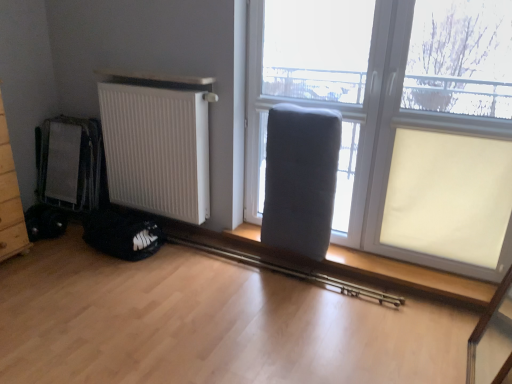
Locate an element on the screen. matte gray cushion at center is located at coordinates (314, 91).

Does white matte radiator at left have a lesser width compared to matte gray cushion at center?

Incorrect, the width of white matte radiator at left is not less than that of matte gray cushion at center.

In the scene shown: Can you confirm if white matte radiator at left is smaller than matte gray cushion at center?

Incorrect, white matte radiator at left is not smaller in size than matte gray cushion at center.

From the picture: Is white matte radiator at left not close to matte gray cushion at center?

Answer: No, white matte radiator at left is in close proximity to matte gray cushion at center.

Measure the distance between white matte radiator at left and matte gray cushion at center.

26.68 inches.

Considering the positions of objects matte gray radiator at lower center and gray fabric armchair at center in the image provided, who is more to the left, matte gray radiator at lower center or gray fabric armchair at center?

gray fabric armchair at center is more to the left.

Based on the photo, from a real-world perspective, between matte gray radiator at lower center and gray fabric armchair at center, who is vertically lower?

From a 3D spatial view, gray fabric armchair at center is below.

Which is further, (475, 231) or (269, 214)?

The point (269, 214) is more distant.

From the picture: From their relative heights in the image, would you say matte gray radiator at lower center is taller or shorter than gray fabric armchair at center?

In the image, matte gray radiator at lower center appears to be taller than gray fabric armchair at center.

In the scene shown: Between matte gray cushion at center and white matte radiator at left, which one appears on the right side from the viewer's perspective?

From the viewer's perspective, matte gray cushion at center appears more on the right side.

From the image's perspective, does matte gray cushion at center appear lower than white matte radiator at left?

No, from the image's perspective, matte gray cushion at center is not below white matte radiator at left.

Are matte gray cushion at center and white matte radiator at left far apart?

No, matte gray cushion at center is not far away from white matte radiator at left.

Is matte gray cushion at center inside or outside of white matte radiator at left?

matte gray cushion at center is outside white matte radiator at left.

Does point (402, 22) appear closer or farther from the camera than point (353, 2)?

Point (402, 22) is closer to the camera than point (353, 2).

Is matte gray radiator at lower center taller or shorter than matte gray cushion at center?

Considering their sizes, matte gray radiator at lower center has more height than matte gray cushion at center.

From a real-world perspective, between matte gray radiator at lower center and matte gray cushion at center, who is vertically higher?

In real-world perspective, matte gray cushion at center is above.

How different are the orientations of matte gray radiator at lower center and matte gray cushion at center in degrees?

The facing directions of matte gray radiator at lower center and matte gray cushion at center are 0.00144 degrees apart.

Are gray fabric armchair at center and matte gray radiator at lower center making contact?

No, gray fabric armchair at center is not next to matte gray radiator at lower center.

Who is bigger, gray fabric armchair at center or matte gray radiator at lower center?

matte gray radiator at lower center.

Is gray fabric armchair at center taller or shorter than matte gray radiator at lower center?

In the image, gray fabric armchair at center appears to be shorter than matte gray radiator at lower center.

In the scene shown: Is gray fabric armchair at center positioned with its back to matte gray radiator at lower center?

That's right, gray fabric armchair at center is facing away from matte gray radiator at lower center.

Is matte gray cushion at center closer to camera compared to gray fabric armchair at center?

Yes, matte gray cushion at center is closer to the viewer.

Consider the image. From the image's perspective, is matte gray cushion at center located beneath gray fabric armchair at center?

No, from the image's perspective, matte gray cushion at center is not beneath gray fabric armchair at center.

Is matte gray cushion at center facing away from gray fabric armchair at center?

Yes, matte gray cushion at center is facing away from gray fabric armchair at center.

Looking at this image, from the image's perspective, does gray fabric armchair at center appear higher than white matte radiator at left?

No.

Considering the relative sizes of gray fabric armchair at center and white matte radiator at left in the image provided, is gray fabric armchair at center thinner than white matte radiator at left?

No, gray fabric armchair at center is not thinner than white matte radiator at left.

Considering the relative positions of gray fabric armchair at center and white matte radiator at left in the image provided, is gray fabric armchair at center to the left of white matte radiator at left from the viewer's perspective?

No.

Does gray fabric armchair at center lie in front of white matte radiator at left?

That is True.

The height and width of the screenshot is (384, 512). In the image, there is a white matte radiator at left. In order to click on window frame above it (from the image's perspective) in this screenshot , I will do `click(314, 91)`.

Where is `armchair that appears behind the matte gray radiator at lower center`? The height and width of the screenshot is (384, 512). armchair that appears behind the matte gray radiator at lower center is located at coordinates (300, 179).

From the image, which object appears to be farther from matte gray cushion at center, matte gray radiator at lower center or white matte radiator at left?

Among the two, white matte radiator at left is located further to matte gray cushion at center.

Looking at the image, which one is located further to gray fabric armchair at center, white matte radiator at left or matte gray cushion at center?

white matte radiator at left lies further to gray fabric armchair at center than the other object.

Based on their spatial positions, is gray fabric armchair at center or white matte radiator at left further from matte gray radiator at lower center?

Based on the image, white matte radiator at left appears to be further to matte gray radiator at lower center.

Consider the image. Estimate the real-world distances between objects in this image. Which object is further from gray fabric armchair at center, matte gray cushion at center or white matte radiator at left?

white matte radiator at left is positioned further to the anchor gray fabric armchair at center.

Which object lies nearer to the anchor point gray fabric armchair at center, white matte radiator at left or matte gray radiator at lower center?

The object closer to gray fabric armchair at center is matte gray radiator at lower center.

Estimate the real-world distances between objects in this image. Which object is further from matte gray radiator at lower center, white matte radiator at left or gray fabric armchair at center?

Based on the image, white matte radiator at left appears to be further to matte gray radiator at lower center.

Which object lies nearer to the anchor point gray fabric armchair at center, matte gray cushion at center or matte gray radiator at lower center?

Based on the image, matte gray cushion at center appears to be nearer to gray fabric armchair at center.

Which object lies further to the anchor point matte gray cushion at center, white matte radiator at left or gray fabric armchair at center?

white matte radiator at left is further to matte gray cushion at center.

This screenshot has height=384, width=512. Find the location of `window frame positioned between matte gray radiator at lower center and gray fabric armchair at center from near to far`. window frame positioned between matte gray radiator at lower center and gray fabric armchair at center from near to far is located at coordinates (314, 91).

What are the coordinates of `armchair between white matte radiator at left and matte gray radiator at lower center from left to right` in the screenshot? It's located at (300, 179).

The width and height of the screenshot is (512, 384). What are the coordinates of `armchair situated between white matte radiator at left and matte gray cushion at center from left to right` in the screenshot? It's located at (300, 179).

Locate an element on the screen. The image size is (512, 384). window frame located between white matte radiator at left and matte gray radiator at lower center in the left-right direction is located at coordinates (314, 91).